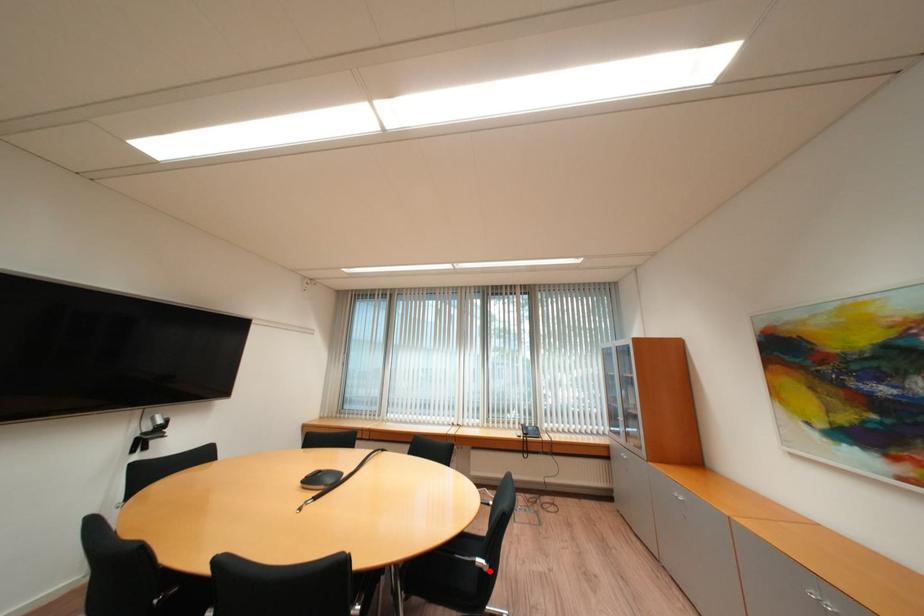
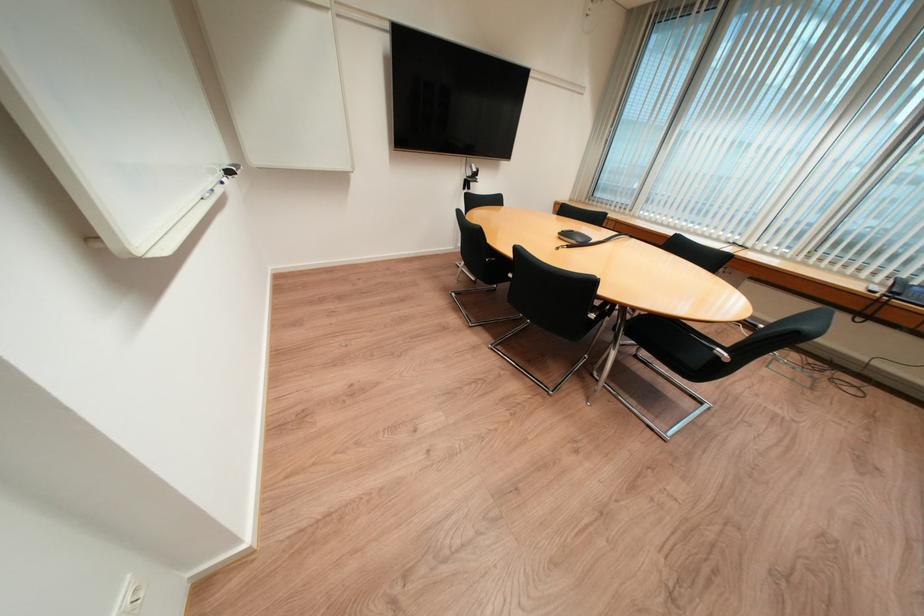
In the second image, find the point that corresponds to the highlighted location in the first image.

(725, 359)